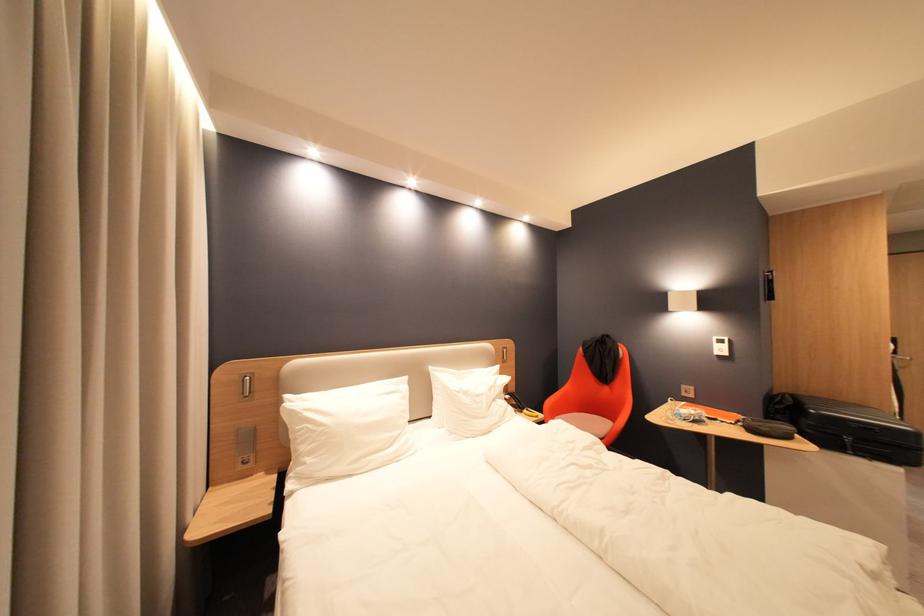
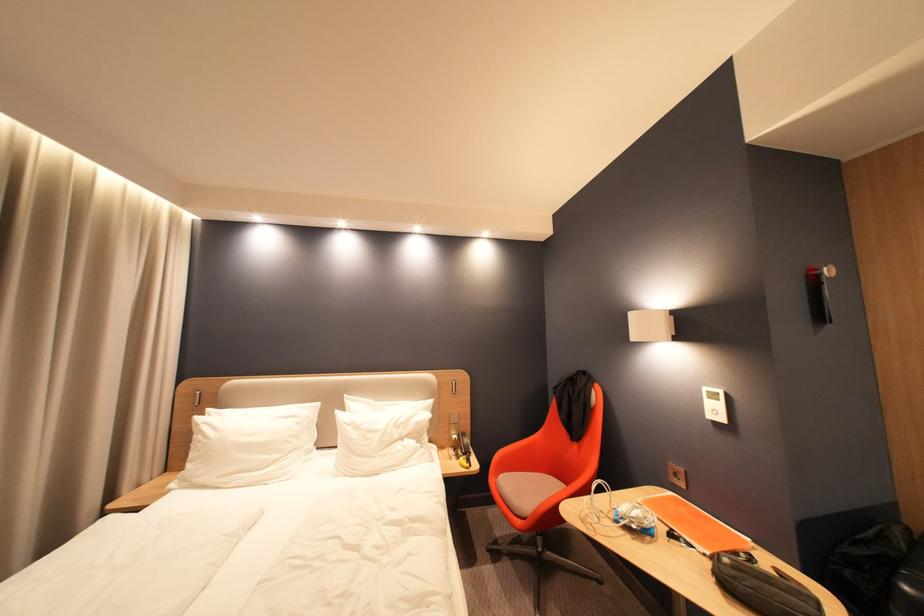
Where in the second image is the point corresponding to point 781,274 from the first image?

(830, 270)